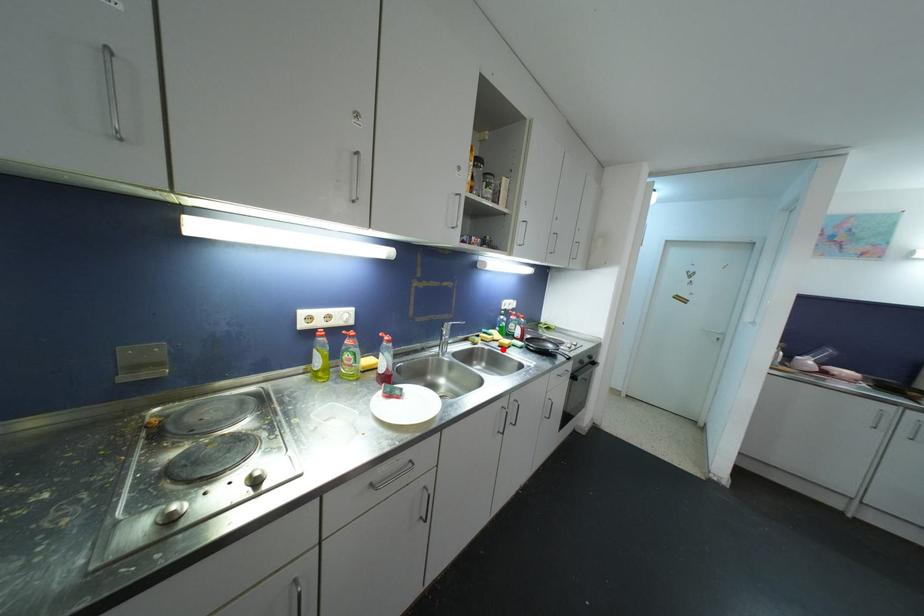
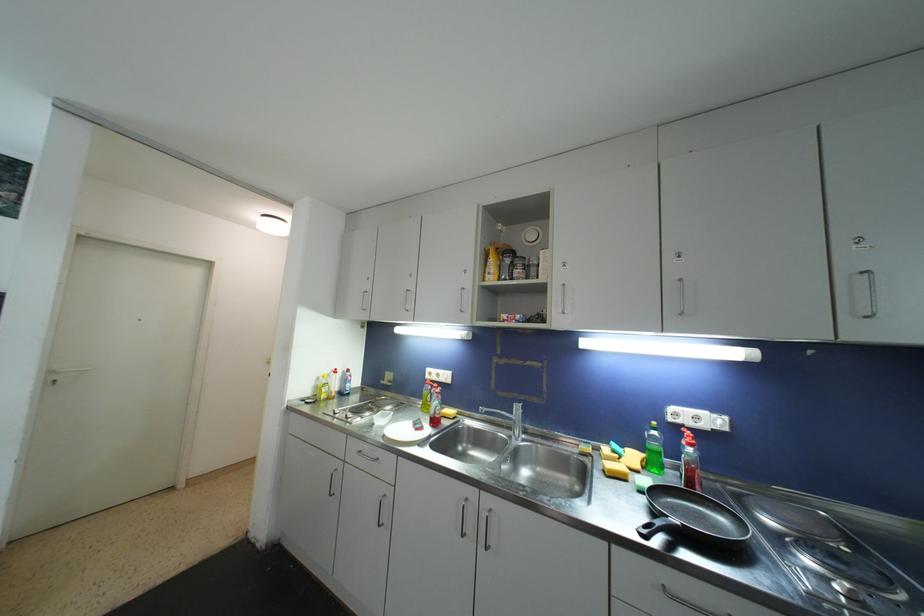
Locate, in the second image, the point that corresponds to the highlighted location in the first image.

(608, 474)